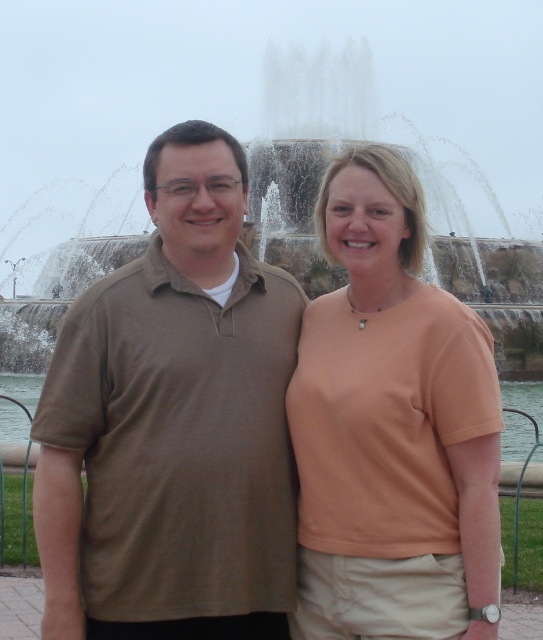
Question: Considering the real-world distances, which object is farthest from the matte peach shirt at center?

Choices:
 (A) stone water at center
 (B) brown cotton shirt at center

Answer: (A)

Question: Does matte peach shirt at center have a smaller size compared to stone water at center?

Choices:
 (A) no
 (B) yes

Answer: (B)

Question: Which object is closer to the camera taking this photo?

Choices:
 (A) brown cotton shirt at center
 (B) stone water at center

Answer: (A)

Question: Which point appears farthest from the camera in this image?

Choices:
 (A) [169, 465]
 (B) [464, 340]

Answer: (B)

Question: Does brown cotton shirt at center have a larger size compared to stone water at center?

Choices:
 (A) yes
 (B) no

Answer: (B)

Question: Is matte peach shirt at center bigger than stone water at center?

Choices:
 (A) no
 (B) yes

Answer: (A)